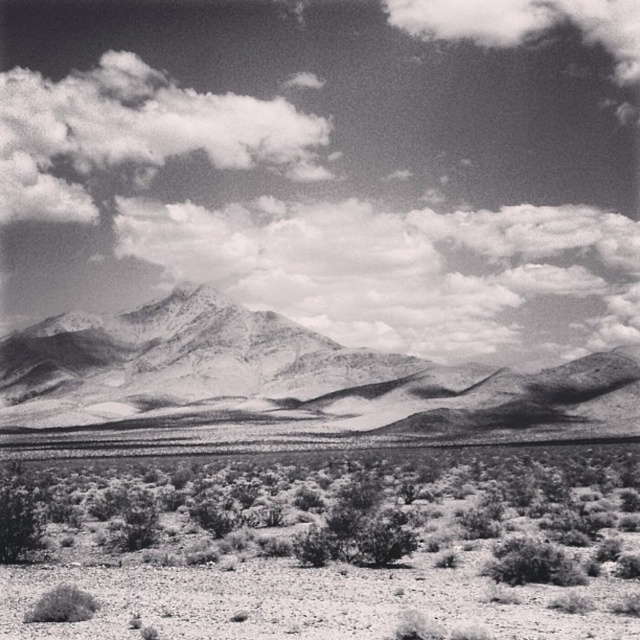
Question: Can you confirm if cloudy sky at upper center is positioned above smooth gray mountain range at center?

Choices:
 (A) yes
 (B) no

Answer: (A)

Question: Does cloudy sky at upper center have a lesser width compared to cloudy sky at upper left?

Choices:
 (A) yes
 (B) no

Answer: (B)

Question: Based on their relative distances, which object is farther from the smooth gray mountain range at center?

Choices:
 (A) cloudy sky at upper center
 (B) cloudy sky at upper left

Answer: (B)

Question: Which object is positioned farthest from the gravelly desert shrubs at lower center?

Choices:
 (A) smooth gray mountain range at center
 (B) cloudy sky at upper center
 (C) cloudy sky at upper left

Answer: (C)

Question: Which object is positioned farthest from the cloudy sky at upper left?

Choices:
 (A) cloudy sky at upper center
 (B) gravelly desert shrubs at lower center
 (C) smooth gray mountain range at center

Answer: (B)

Question: Is cloudy sky at upper center smaller than smooth gray mountain range at center?

Choices:
 (A) yes
 (B) no

Answer: (B)